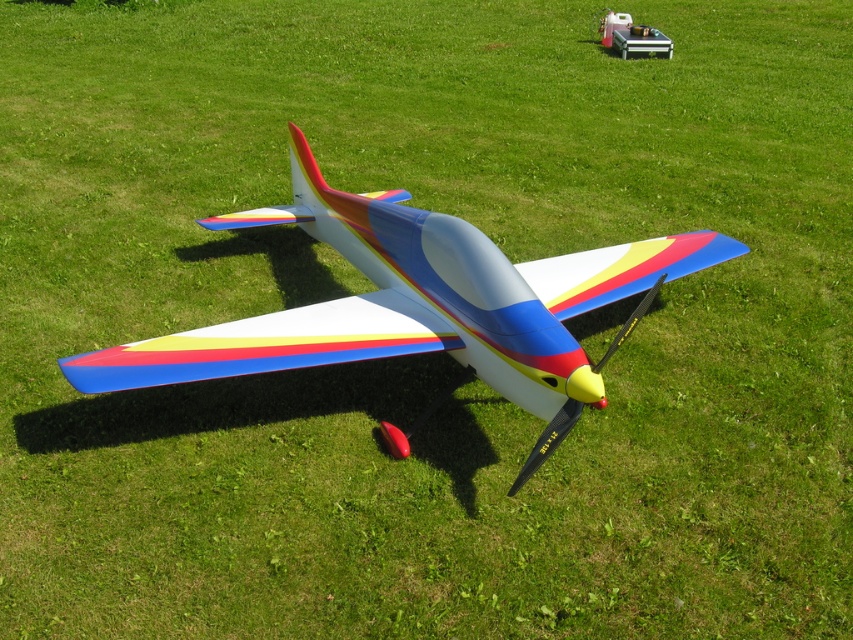
You are a child who wants to play with both the matte plastic airplane at center and the metallic silver toolbox at upper center. Which object can you reach first if you start walking from the edge of the grassy field towards the center?

The matte plastic airplane at center can be reached first because it is closer to the edge of the grassy field than the metallic silver toolbox at upper center, which is positioned further away.

You are a photographer trying to capture the matte plastic airplane at center. You notice a point at coordinates (x=421, y=305). Is this point likely located on the airplane?

Yes, the point at coordinates (x=421, y=305) corresponds to the matte plastic airplane at center, so it is located on the airplane.